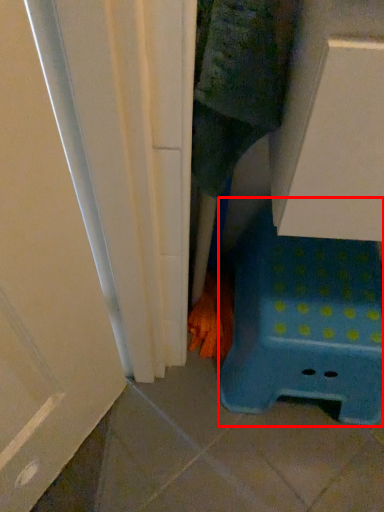
Question: From the image's perspective, considering the relative positions of furniture (annotated by the red box) and hand in the image provided, where is furniture (annotated by the red box) located with respect to the staircase?

Choices:
 (A) below
 (B) above

Answer: (B)